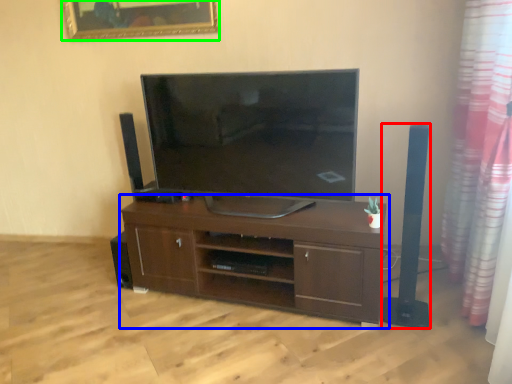
Question: Which is farther away from speaker (highlighted by a red box)? cabinetry (highlighted by a blue box) or picture frame (highlighted by a green box)?

Choices:
 (A) cabinetry
 (B) picture frame

Answer: (B)